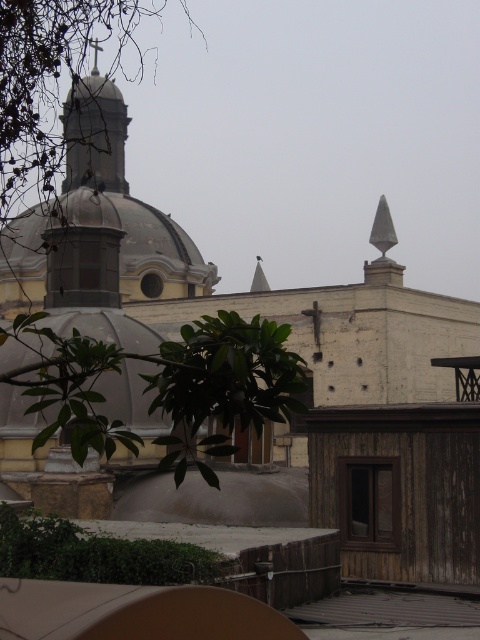
Which of these two, gray stone dome at upper left or green leafy tree at center, stands shorter?

Standing shorter between the two is green leafy tree at center.

Identify the location of gray stone dome at upper left. This screenshot has height=640, width=480. (129, 198).